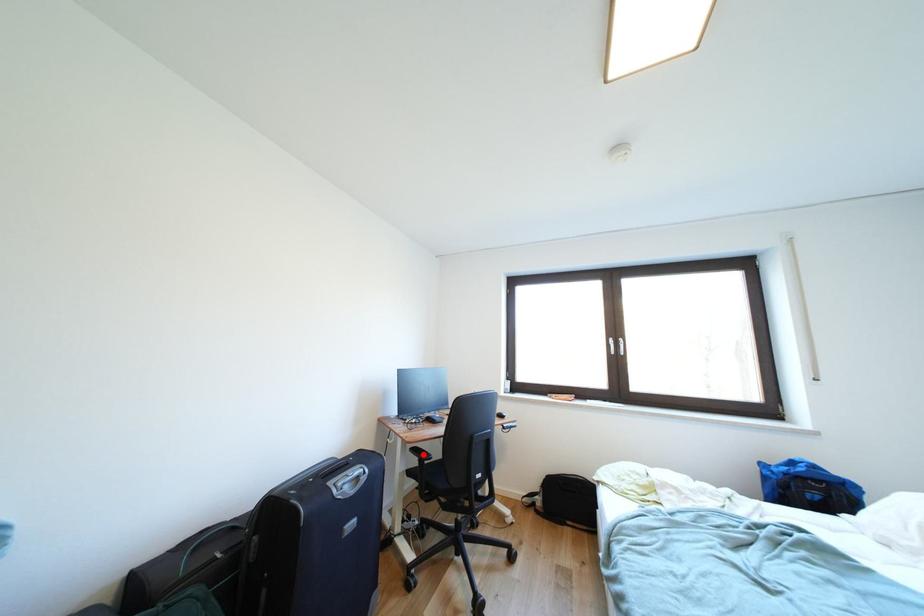
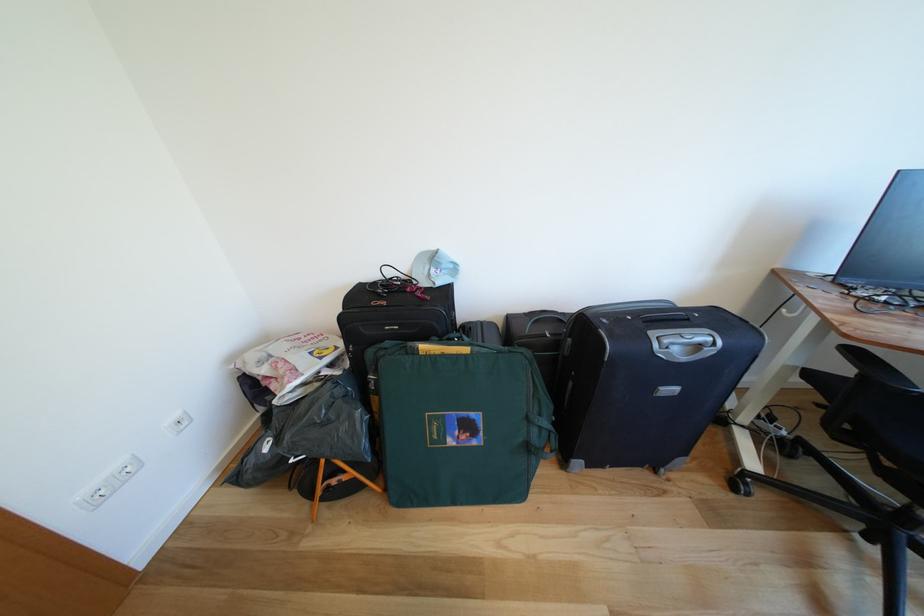
In the second image, find the point that corresponds to the highlighted location in the first image.

(862, 357)